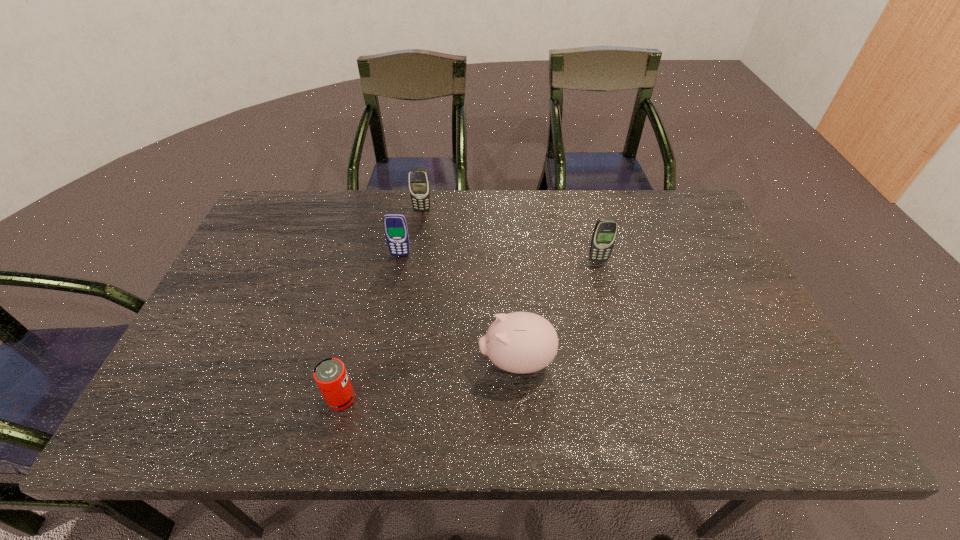
The image size is (960, 540). I want to click on free spot at the far right corner of the desktop, so click(679, 201).

Identify the location of vacant region between the can and the piggy bank. (428, 380).

Identify the location of unoccupied area between the piggy bank and the shortest object. This screenshot has height=540, width=960. click(428, 380).

Identify the location of blank region between the piggy bank and the rightmost object. (557, 310).

Where is `free area in between the nearest cellular telephone and the second farthest cellular telephone`? The image size is (960, 540). free area in between the nearest cellular telephone and the second farthest cellular telephone is located at coordinates (499, 258).

In order to click on free space between the rightmost object and the piggy bank in this screenshot , I will do `click(557, 310)`.

The image size is (960, 540). In order to click on free spot between the fourth nearest object and the leftmost object in this screenshot , I will do `click(371, 327)`.

In order to click on free space between the leftmost object and the farthest object in this screenshot , I will do `click(381, 304)`.

Identify the location of free space between the rightmost cellular telephone and the second farthest cellular telephone. (499, 258).

The image size is (960, 540). I want to click on free spot between the fourth nearest object and the piggy bank, so click(458, 308).